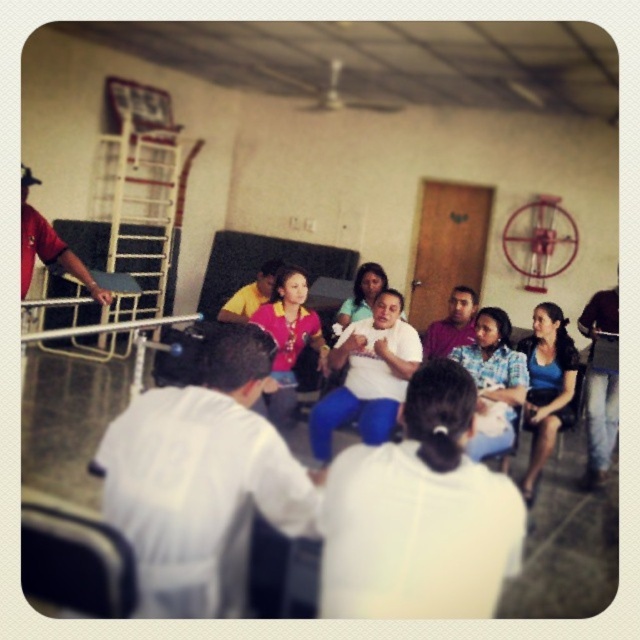
Is blue cotton pants at center positioned in front of blue fabric shirt at center?

Yes, blue cotton pants at center is closer to the viewer.

Who is more forward, (492,518) or (508,372)?

Point (492,518)

Locate an element on the screen. The image size is (640, 640). blue cotton pants at center is located at coordinates (419, 515).

Is point (339, 412) in front of point (264, 324)?

Yes, point (339, 412) is in front of point (264, 324).

Which of these two, matte white shirt at center or matte pink shirt at center, stands taller?

matte white shirt at center

Between point (378, 339) and point (292, 333), which one is positioned in front?

Point (378, 339) is in front.

You are a GUI agent. You are given a task and a screenshot of the screen. Output one action in this format:
    pyautogui.click(x=<x>, y=<y>)
    Task: Click on the matte white shirt at center
    The width and height of the screenshot is (640, 640).
    Given the screenshot: What is the action you would take?
    pyautogui.click(x=368, y=376)

Can you confirm if white matte shirt at center is shorter than blue cotton pants at center?

Incorrect, white matte shirt at center's height does not fall short of blue cotton pants at center's.

Does white matte shirt at center appear under blue cotton pants at center?

Incorrect, white matte shirt at center is not positioned below blue cotton pants at center.

This screenshot has width=640, height=640. Find the location of `white matte shirt at center`. white matte shirt at center is located at coordinates (202, 480).

Identify the location of white matte shirt at center. (202, 480).